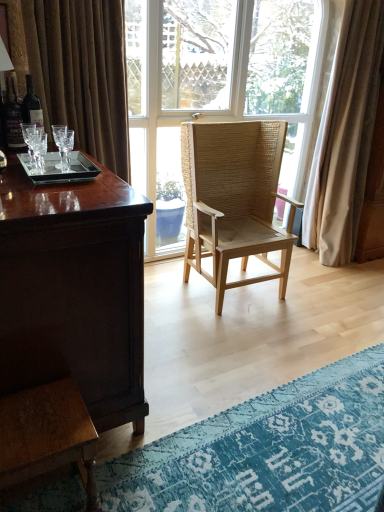
Locate an element on the screen. The image size is (384, 512). free space above wooden table at lower left (from a real-world perspective) is located at coordinates (36, 417).